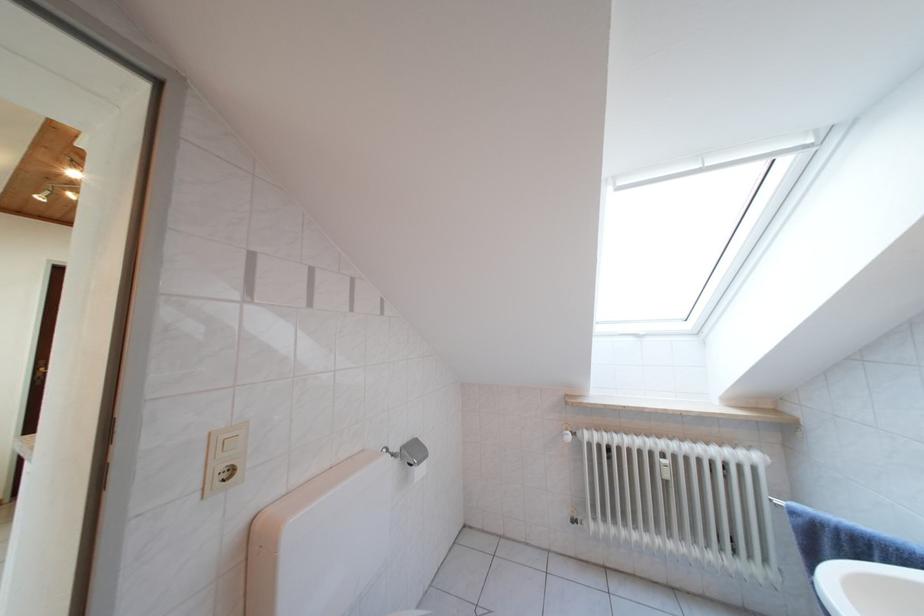
At what (x,y) coordinates should I click in order to perform the action: click on toilet paper holder. Please return your answer as a coordinate pair (x, y). The width and height of the screenshot is (924, 616). Looking at the image, I should click on (414, 458).